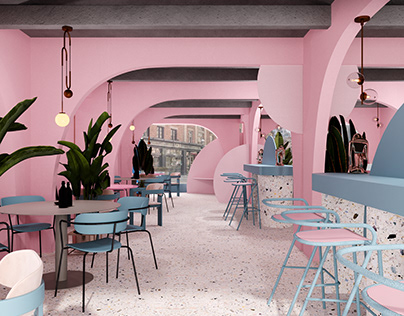
Where is `bar area`? bar area is located at coordinates (393, 181), (389, 299), (313, 224), (330, 181).